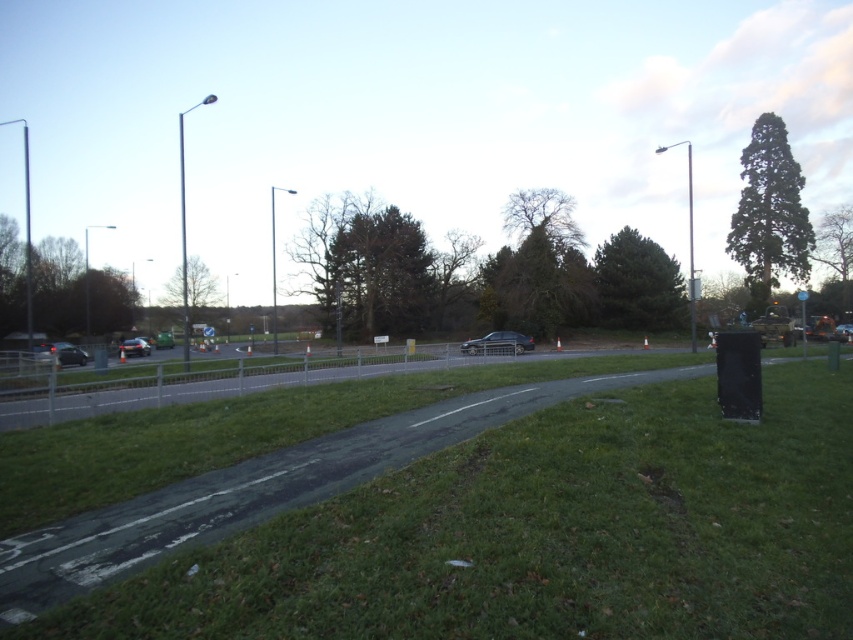
Question: Is satin silver sedan at center further to camera compared to shiny silver car at lower left?

Choices:
 (A) no
 (B) yes

Answer: (A)

Question: Is satin silver sedan at center wider than matte black car at lower left?

Choices:
 (A) yes
 (B) no

Answer: (A)

Question: Which point is farther to the camera?

Choices:
 (A) (701, 577)
 (B) (144, 339)
 (C) (36, 352)

Answer: (B)

Question: Based on their relative distances, which object is nearer to the green grass at lower center?

Choices:
 (A) matte black car at lower left
 (B) satin silver sedan at center

Answer: (B)

Question: Based on their relative distances, which object is nearer to the shiny silver car at lower left?

Choices:
 (A) matte black car at lower left
 (B) satin silver sedan at center
 (C) green grass at lower center

Answer: (A)

Question: Can you confirm if satin silver sedan at center is bigger than shiny silver car at lower left?

Choices:
 (A) yes
 (B) no

Answer: (B)